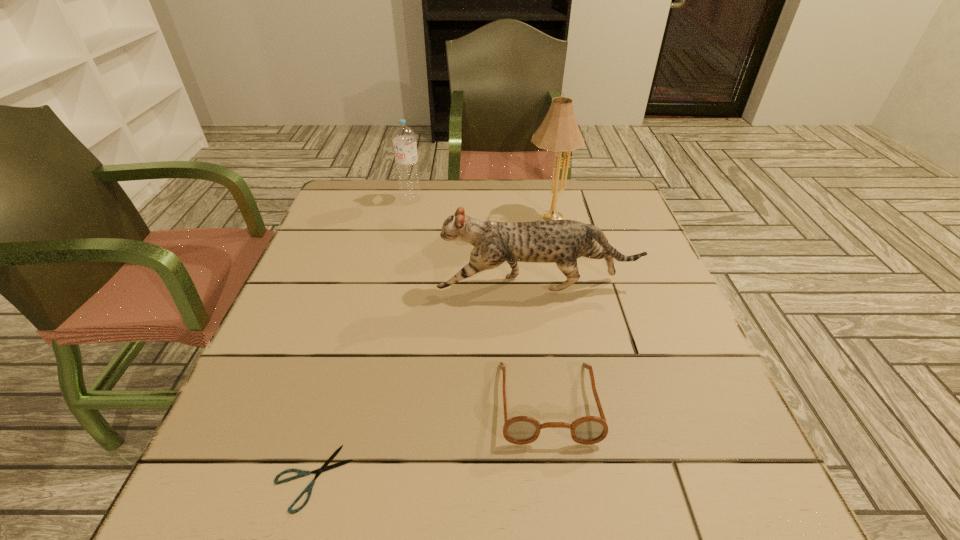
Image resolution: width=960 pixels, height=540 pixels. What are the coordinates of `object that stands as the second closest to the shears` in the screenshot? It's located at (562, 241).

At what (x,y) coordinates should I click in order to perform the action: click on the fourth closest object relative to the shortest object. Please return your answer as a coordinate pair (x, y). The image size is (960, 540). Looking at the image, I should click on (404, 138).

You are a GUI agent. You are given a task and a screenshot of the screen. Output one action in this format:
    pyautogui.click(x=<x>, y=<y>)
    Task: Click on the free point that satisfies the following two spatial constraints: 1. on the face of the third farthest object; 2. on the front side of the shears
    
    Given the screenshot: What is the action you would take?
    pyautogui.click(x=565, y=478)

This screenshot has height=540, width=960. Find the location of `free location that satisfies the following two spatial constraints: 1. on the face of the third nearest object; 2. on the front-facing side of the fourth tallest object`. free location that satisfies the following two spatial constraints: 1. on the face of the third nearest object; 2. on the front-facing side of the fourth tallest object is located at coordinates (554, 402).

Find the location of a particular element. The image size is (960, 540). free spot that satisfies the following two spatial constraints: 1. on the face of the third nearest object; 2. on the front-facing side of the fourth tallest object is located at coordinates (554, 402).

Locate an element on the screen. Image resolution: width=960 pixels, height=540 pixels. free spot that satisfies the following two spatial constraints: 1. on the front side of the tallest object; 2. on the face of the third tallest object is located at coordinates (564, 286).